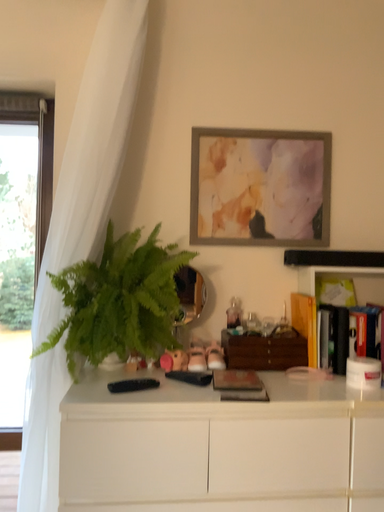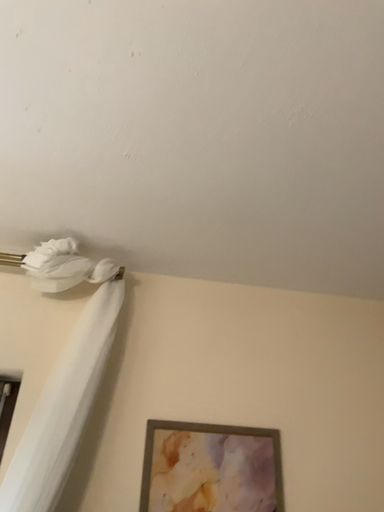
Question: Which way did the camera rotate in the video?

Choices:
 (A) rotated downward
 (B) rotated upward

Answer: (B)